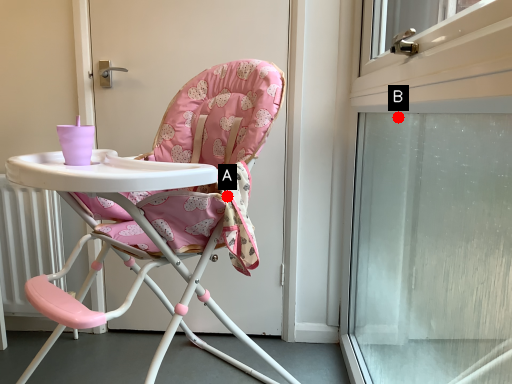
Question: Two points are circled on the image, labeled by A and B beside each circle. Which point appears closest to the camera in this image?

Choices:
 (A) A is closer
 (B) B is closer

Answer: (A)